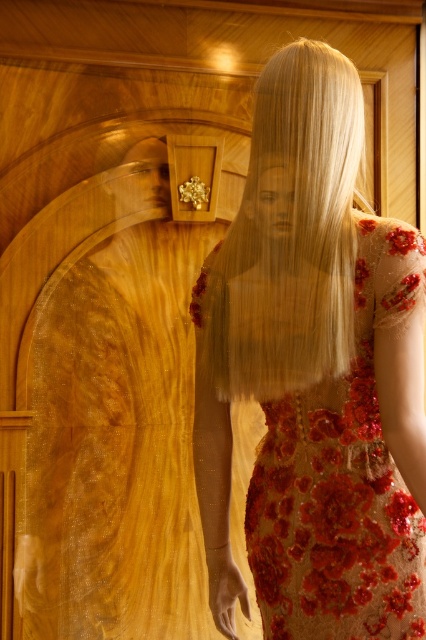
Question: Observing the image, what is the correct spatial positioning of sequined fabric dress at center in reference to blonde silky hair at center?

Choices:
 (A) right
 (B) left

Answer: (A)

Question: Which point appears farthest from the camera in this image?

Choices:
 (A) (359, 333)
 (B) (328, 227)

Answer: (B)

Question: Does sequined fabric dress at center have a lesser width compared to blonde silky hair at center?

Choices:
 (A) no
 (B) yes

Answer: (A)

Question: Which point is farther to the camera?

Choices:
 (A) (360, 154)
 (B) (264, 250)

Answer: (A)

Question: Is sequined fabric dress at center to the left of blonde silky hair at center from the viewer's perspective?

Choices:
 (A) yes
 (B) no

Answer: (B)